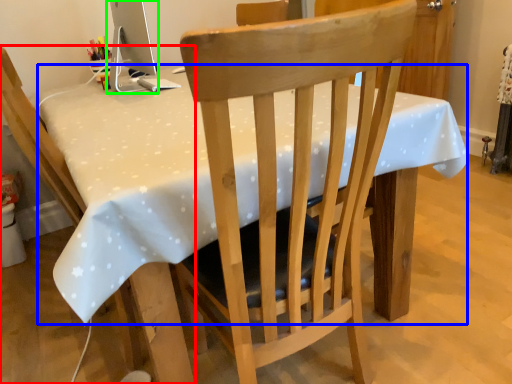
Question: Based on their relative distances, which object is nearer to chair (highlighted by a red box)? Choose from table (highlighted by a blue box) and computer monitor (highlighted by a green box).

Choices:
 (A) table
 (B) computer monitor

Answer: (A)